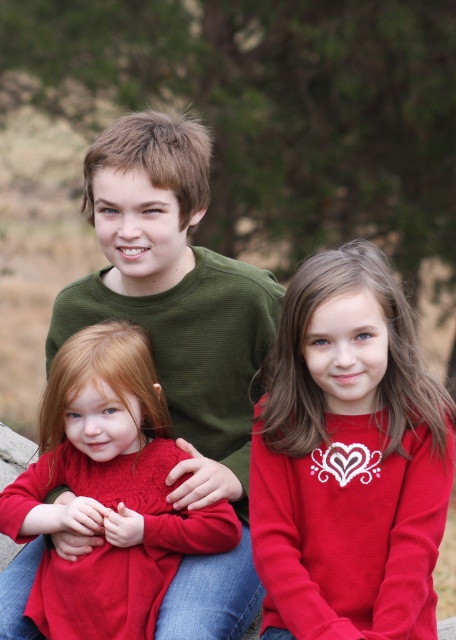
Who is positioned more to the left, matte red sweater at center or green textured sweater at center?

green textured sweater at center

In the scene shown: Is matte red sweater at center smaller than green textured sweater at center?

Yes.

Between point (361, 516) and point (157, 289), which one is positioned behind?

Point (157, 289)

Where is `matte red sweater at center`? This screenshot has height=640, width=456. matte red sweater at center is located at coordinates (350, 472).

Identify the location of green textured sweater at center. (181, 339).

Who is higher up, green textured sweater at center or matte red sweater at left?

green textured sweater at center is higher up.

Who is more distant from viewer, [245,440] or [139,480]?

The point [245,440] is more distant.

Locate an element on the screen. green textured sweater at center is located at coordinates pos(181,339).

Can you confirm if matte red sweater at center is taller than matte red sweater at left?

Yes, matte red sweater at center is taller than matte red sweater at left.

I want to click on matte red sweater at center, so click(350, 472).

Where is `matte red sweater at center`? The width and height of the screenshot is (456, 640). matte red sweater at center is located at coordinates [x=350, y=472].